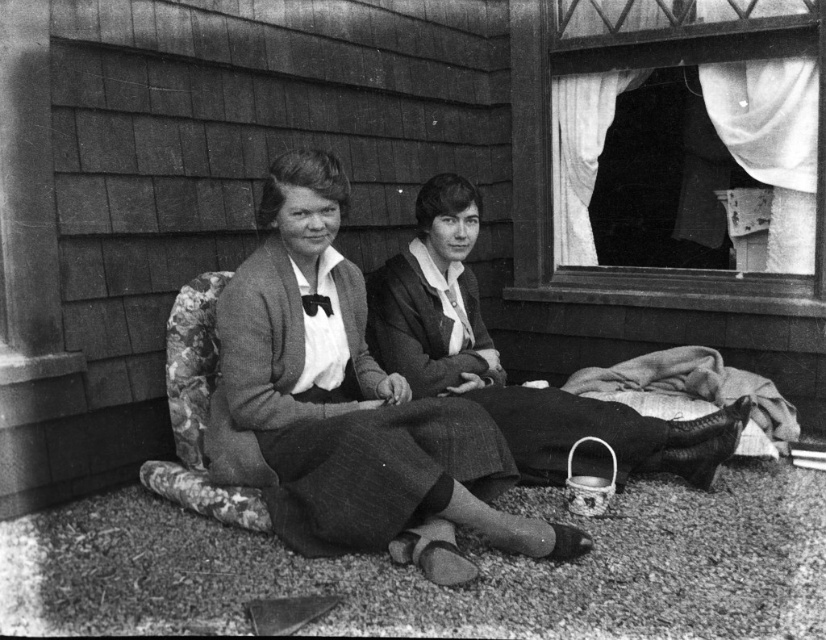
Question: Which point is closer to the camera?

Choices:
 (A) (316, 493)
 (B) (392, 262)

Answer: (A)

Question: Does matte black dress at center appear on the left side of smooth fabric dress at center?

Choices:
 (A) no
 (B) yes

Answer: (B)

Question: Can you confirm if matte black dress at center is smaller than smooth fabric dress at center?

Choices:
 (A) no
 (B) yes

Answer: (A)

Question: Among these objects, which one is nearest to the camera?

Choices:
 (A) matte black dress at center
 (B) smooth fabric dress at center

Answer: (A)

Question: Does matte black dress at center appear under smooth fabric dress at center?

Choices:
 (A) no
 (B) yes

Answer: (B)